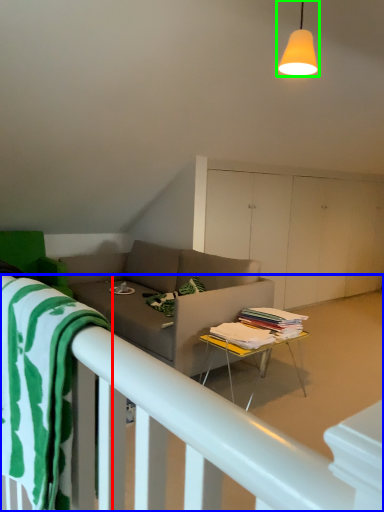
Question: Considering the real-world distances, which object is closest to beach towel (highlighted by a red box)? bed frame (highlighted by a blue box) or light fixture (highlighted by a green box).

Choices:
 (A) bed frame
 (B) light fixture

Answer: (A)